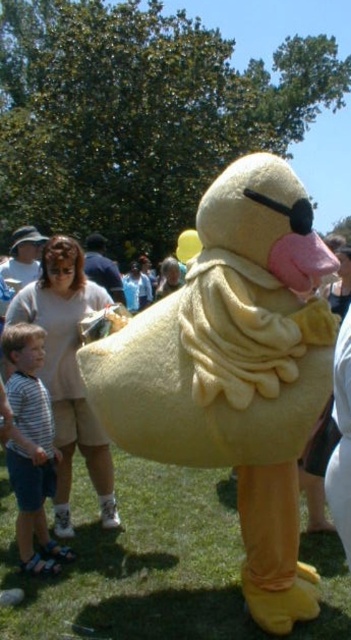
You are standing in the scene and want to take a photo of the duck costume. There are two points marked in the image. Which point is closer to you, point (151, 364) or point (38, 516)?

Point (151, 364) is closer to the camera than point (38, 516), so the point closer to you is point (151, 364).

You are a photographer trying to capture a group photo of the yellow plush duck at center and the striped fabric shirt at lower left. Since you want to ensure both subjects are fully visible, which subject requires more space in the frame?

The yellow plush duck at center requires more space in the frame because its width surpasses that of the striped fabric shirt at lower left.

You are a photographer trying to capture a photo of the yellow plush duck at center and the striped fabric shirt at lower left. Since you want to emphasize the size difference between them, which object should you position closer to the camera to make it appear larger?

The yellow plush duck at center is taller than the striped fabric shirt at lower left, so to emphasize the size difference, you should position the striped fabric shirt at lower left closer to the camera. This way, the shirt will appear larger in the photo, contrasting with the duck which is farther away but naturally taller, highlighting their size disparity.